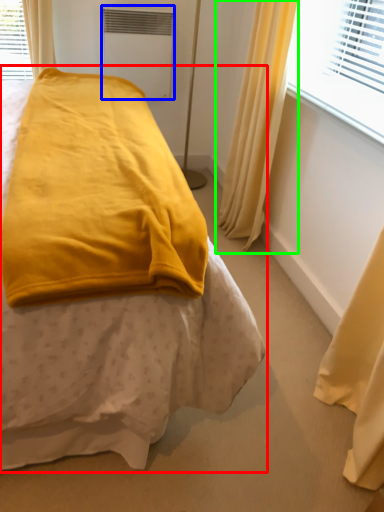
Question: Based on their relative distances, which object is farther from bed (highlighted by a red box)? Choose from air conditioning (highlighted by a blue box) and curtain (highlighted by a green box).

Choices:
 (A) air conditioning
 (B) curtain

Answer: (A)